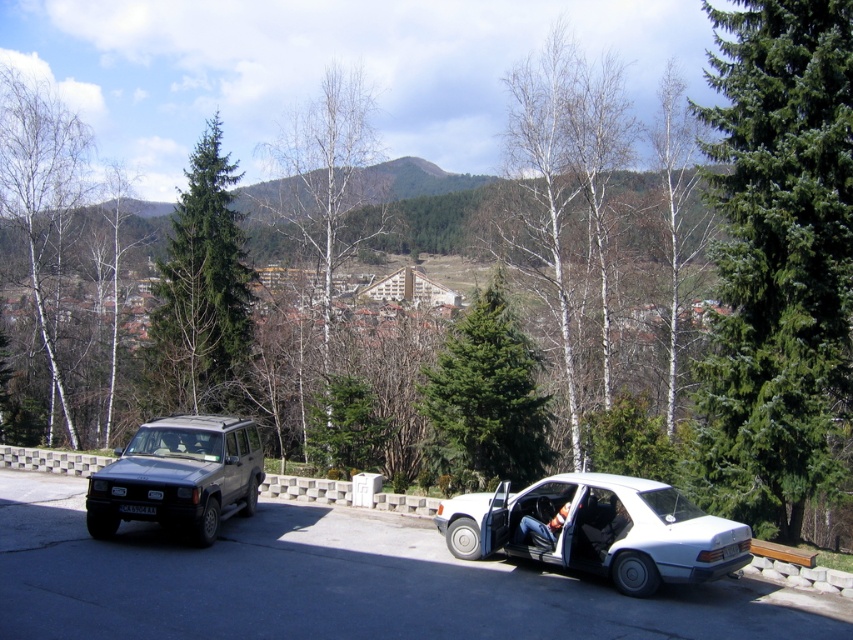
You are a parking attendant and need to guide a driver to park their car between the white matte sedan at center and the metallic gray suv at left. Based on the current arrangement, is there enough space between these two vehicles for a standard compact car? Please explain your reasoning.

The white matte sedan at center is located below the metallic gray suv at left, which means they are parked in a staggered position. However, without specific distance measurements between them, it is impossible to determine if there is enough space for a standard compact car. Additional information about the spacing between the two vehicles is required to make an accurate assessment.

You are a parking attendant and need to move the white matte sedan at center and the metallic gray suv at left to a new parking lot. The new parking lot has a width limit of 2 meters. Which vehicle will you have to check the dimensions of first?

The metallic gray suv at left is larger in size compared to the white matte sedan at center, so you should check the dimensions of the metallic gray suv at left first to ensure it fits within the 2 meter width limit.

You are standing at the point marked as point (599, 529) in the image. What object is exactly at that location?

The white matte sedan at center is located exactly at point (599, 529).